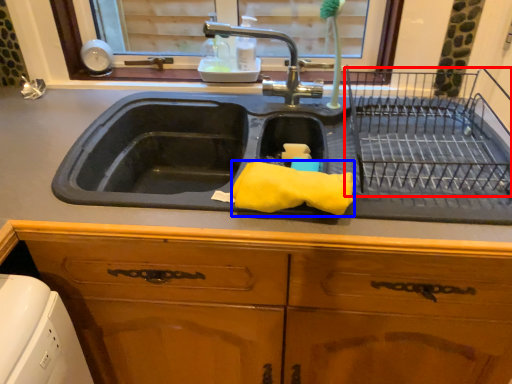
Question: Which of the following is the closest to the observer, cage (highlighted by a red box) or material (highlighted by a blue box)?

Choices:
 (A) cage
 (B) material

Answer: (A)